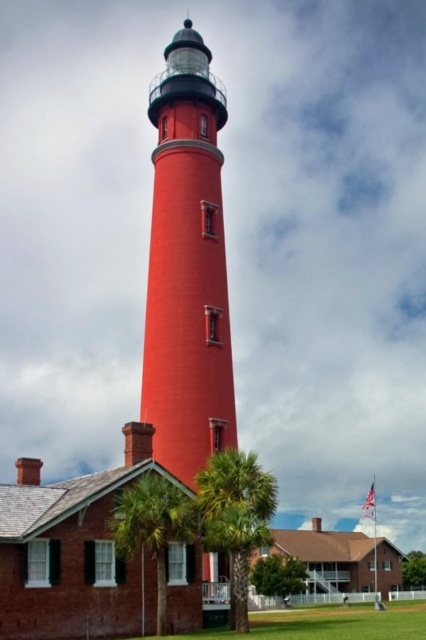
You are standing in front of the lighthouse and want to walk towards the green leafy palm tree at center. However, there is another green leafy palm tree at lower center in your path. Which palm tree will you encounter first?

You will encounter the green leafy palm tree at lower center first because it is in front of the green leafy palm tree at center, so you must pass it to reach the one behind.

You are a tourist visiting the lighthouse and want to take a photo of both the matte red lighthouse at center and the green leafy palm tree at center. Where should you position yourself to ensure both are visible in the frame?

To capture both the matte red lighthouse at center and the green leafy palm tree at center in your photo, position yourself in front of the lighthouse. Since the green leafy palm tree at center is behind the matte red lighthouse at center, standing in front of the lighthouse will allow you to frame the palm tree through or around the lighthouse structure, ensuring both are visible.